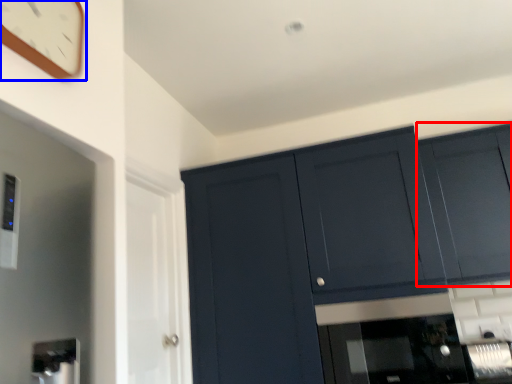
Question: Among these objects, which one is farthest to the camera, cabinetry (highlighted by a red box) or clock (highlighted by a blue box)?

Choices:
 (A) cabinetry
 (B) clock

Answer: (A)